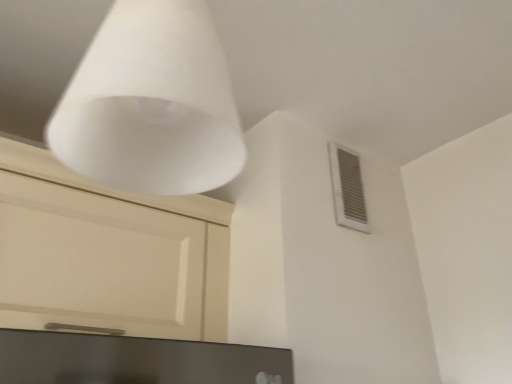
I want to click on white plastic vent at upper right, so click(x=348, y=189).

From their relative heights in the image, would you say white matte cone at upper center is taller or shorter than matte black monitor at lower center?

In the image, white matte cone at upper center appears to be taller than matte black monitor at lower center.

Looking at their sizes, would you say white matte cone at upper center is wider or thinner than matte black monitor at lower center?

Considering their sizes, white matte cone at upper center looks slimmer than matte black monitor at lower center.

Which is correct: white matte cone at upper center is inside matte black monitor at lower center, or outside of it?

white matte cone at upper center cannot be found inside matte black monitor at lower center.

From the image's perspective, relative to matte black monitor at lower center, is white matte cone at upper center above or below?

Based on their image positions, white matte cone at upper center is located above matte black monitor at lower center.

Consider the image. Between white plastic vent at upper right and white matte cone at upper center, which one has larger size?

white matte cone at upper center.

How different are the orientations of white plastic vent at upper right and white matte cone at upper center in degrees?

The angular difference between white plastic vent at upper right and white matte cone at upper center is 89.1 degrees.

From the image's perspective, is white plastic vent at upper right located above white matte cone at upper center?

No.

Is white plastic vent at upper right turned away from white matte cone at upper center?

white plastic vent at upper right does not have its back to white matte cone at upper center.

Looking at their sizes, would you say white matte cone at upper center is wider or thinner than white plastic vent at upper right?

Clearly, white matte cone at upper center has more width compared to white plastic vent at upper right.

Considering the relative positions of white matte cone at upper center and white plastic vent at upper right in the image provided, is white matte cone at upper center to the left of white plastic vent at upper right from the viewer's perspective?

Correct, you'll find white matte cone at upper center to the left of white plastic vent at upper right.

Is white matte cone at upper center smaller than white plastic vent at upper right?

Actually, white matte cone at upper center might be larger than white plastic vent at upper right.

From a real-world perspective, is matte black monitor at lower center physically below white matte cone at upper center?

Yes, from a real-world perspective, matte black monitor at lower center is under white matte cone at upper center.

Is matte black monitor at lower center thinner than white matte cone at upper center?

No.

Is matte black monitor at lower center taller than white matte cone at upper center?

No, matte black monitor at lower center is not taller than white matte cone at upper center.

Based on the photo, is matte black monitor at lower center beside white matte cone at upper center?

matte black monitor at lower center is not next to white matte cone at upper center, and they're not touching.

Between white plastic vent at upper right and matte black monitor at lower center, which one has larger width?

matte black monitor at lower center is wider.

Is white plastic vent at upper right in front of or behind matte black monitor at lower center in the image?

Visually, white plastic vent at upper right is located behind matte black monitor at lower center.

Choose the correct answer: Is white plastic vent at upper right inside matte black monitor at lower center or outside it?

white plastic vent at upper right lies outside matte black monitor at lower center.

Considering the sizes of objects white plastic vent at upper right and matte black monitor at lower center in the image provided, who is bigger, white plastic vent at upper right or matte black monitor at lower center?

Bigger between the two is matte black monitor at lower center.

Are matte black monitor at lower center and white plastic vent at upper right beside each other?

matte black monitor at lower center and white plastic vent at upper right are clearly separated.

Locate an element on the screen. This screenshot has height=384, width=512. computer monitor located on the left of white plastic vent at upper right is located at coordinates (135, 360).

Which is behind, point (147, 358) or point (335, 183)?

The point (335, 183) is more distant.

Locate an element on the screen. lamp above the matte black monitor at lower center (from the image's perspective) is located at coordinates (x=151, y=103).

Where is `lamp below the white plastic vent at upper right (from a real-world perspective)`? lamp below the white plastic vent at upper right (from a real-world perspective) is located at coordinates (151, 103).

Consider the image. Looking at the image, which one is located closer to matte black monitor at lower center, white plastic vent at upper right or white matte cone at upper center?

white matte cone at upper center is positioned closer to the anchor matte black monitor at lower center.

From the image, which object appears to be farther from white matte cone at upper center, matte black monitor at lower center or white plastic vent at upper right?

Among the two, white plastic vent at upper right is located further to white matte cone at upper center.

Looking at the image, which one is located closer to matte black monitor at lower center, white matte cone at upper center or white plastic vent at upper right?

white matte cone at upper center is closer to matte black monitor at lower center.

When comparing their distances from white plastic vent at upper right, does matte black monitor at lower center or white matte cone at upper center seem closer?

matte black monitor at lower center is closer to white plastic vent at upper right.

Considering their positions, is white matte cone at upper center positioned closer to white plastic vent at upper right than matte black monitor at lower center?

matte black monitor at lower center is closer to white plastic vent at upper right.

Based on their spatial positions, is white plastic vent at upper right or matte black monitor at lower center further from white matte cone at upper center?

white plastic vent at upper right lies further to white matte cone at upper center than the other object.

Locate an element on the screen. computer monitor located between white matte cone at upper center and white plastic vent at upper right in the depth direction is located at coordinates (135, 360).